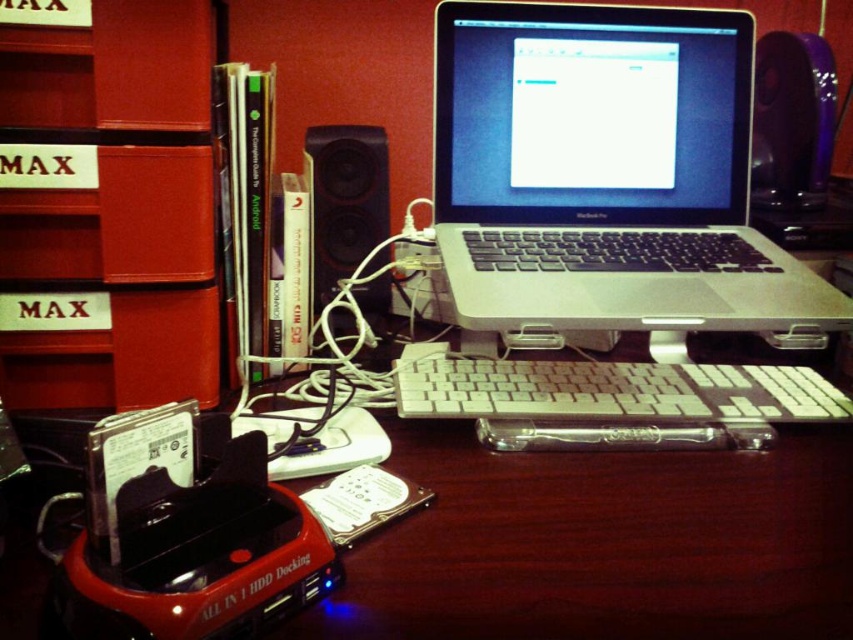
Does silver/black plastic laptop at center appear over black plastic speaker at center?

No.

Does silver/black plastic laptop at center have a lesser width compared to black plastic speaker at center?

Incorrect, silver/black plastic laptop at center's width is not less than black plastic speaker at center's.

Measure the distance between point (622,72) and camera.

Point (622,72) is 32.04 inches away from camera.

Locate an element on the screen. silver/black plastic laptop at center is located at coordinates (605, 173).

Who is more forward, [469,412] or [809,131]?

Point [469,412] is more forward.

Who is lower down, white plastic keyboard at center or purple glossy speaker at upper right?

Positioned lower is white plastic keyboard at center.

Does point (595, 362) come farther from viewer compared to point (798, 186)?

No.

This screenshot has height=640, width=853. Find the location of `white plastic keyboard at center`. white plastic keyboard at center is located at coordinates (614, 390).

Is point (700, 128) less distant than point (473, 372)?

No, it is not.

Does silver/black plastic laptop at center appear on the left side of white plastic keyboard at center?

Incorrect, silver/black plastic laptop at center is not on the left side of white plastic keyboard at center.

I want to click on silver/black plastic laptop at center, so click(605, 173).

You are a GUI agent. You are given a task and a screenshot of the screen. Output one action in this format:
    pyautogui.click(x=<x>, y=<y>)
    Task: Click on the silver/black plastic laptop at center
    
    Given the screenshot: What is the action you would take?
    pyautogui.click(x=605, y=173)